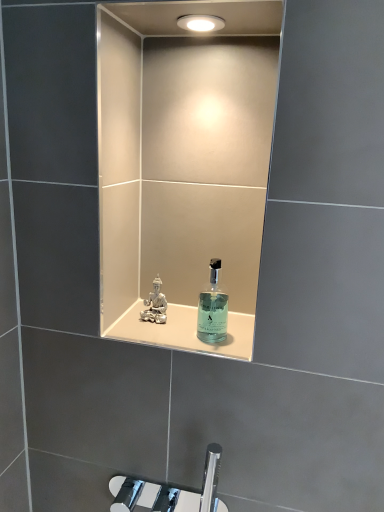
Question: Considering their positions, is clear glass perfume at center located in front of or behind transparent glass bottle at center?

Choices:
 (A) behind
 (B) front

Answer: (A)

Question: Does point (153, 285) appear closer or farther from the camera than point (210, 304)?

Choices:
 (A) farther
 (B) closer

Answer: (A)

Question: Which of these objects is positioned closest to the transparent glass bottle at center?

Choices:
 (A) translucent glass bottle at center
 (B) clear glass perfume at center

Answer: (A)

Question: Based on their relative distances, which object is farther from the transparent glass bottle at center?

Choices:
 (A) translucent glass bottle at center
 (B) clear glass perfume at center

Answer: (B)